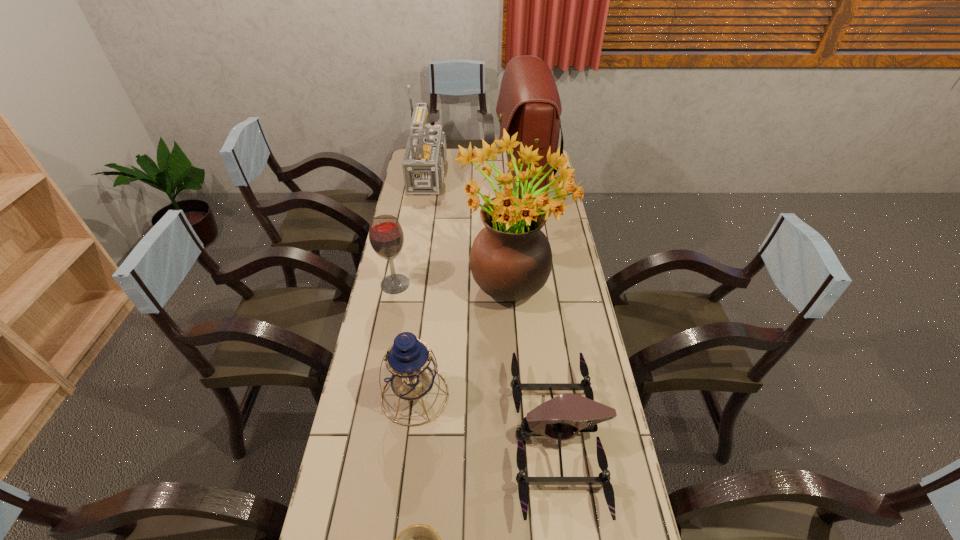
What are the coordinates of `satchel` in the screenshot? It's located at (528, 103).

Find the location of a particular element. The height and width of the screenshot is (540, 960). flower arrangement is located at coordinates (511, 259).

This screenshot has width=960, height=540. Identify the location of the third tallest object. (423, 164).

Locate an element on the screen. alcohol is located at coordinates (386, 236).

Locate an element on the screen. This screenshot has height=540, width=960. lantern is located at coordinates (410, 368).

Locate an element on the screen. the sixth tallest object is located at coordinates (558, 418).

Locate an element on the screen. vacant region located 0.080m on the open flap of the satchel is located at coordinates (478, 183).

The image size is (960, 540). Identify the location of vacant region located on the open flap of the satchel. (476, 183).

Find the location of `free space located 0.140m on the open flap of the satchel`. free space located 0.140m on the open flap of the satchel is located at coordinates (466, 183).

Identify the location of vacant space located 0.050m on the left of the flower arrangement. The width and height of the screenshot is (960, 540). (444, 281).